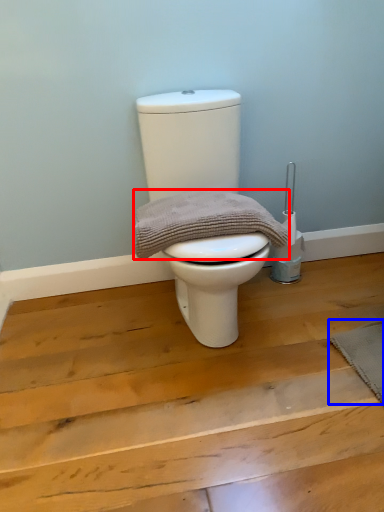
Question: Which object is closer to the camera taking this photo, material (highlighted by a red box) or doormat (highlighted by a blue box)?

Choices:
 (A) material
 (B) doormat

Answer: (A)